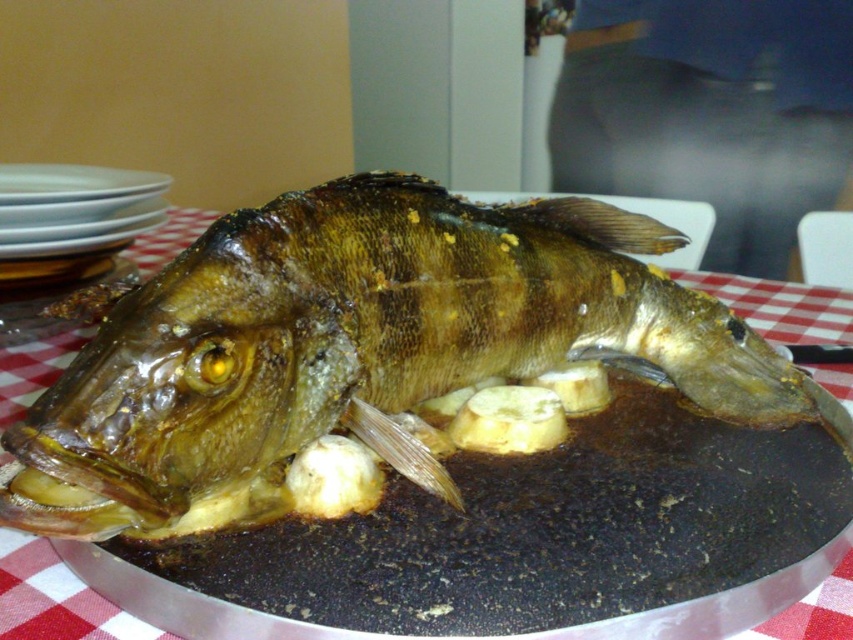
Which is below, shiny brown fish at center or white glossy plate at upper left?

Positioned lower is shiny brown fish at center.

The width and height of the screenshot is (853, 640). What are the coordinates of `shiny brown fish at center` in the screenshot? It's located at (361, 342).